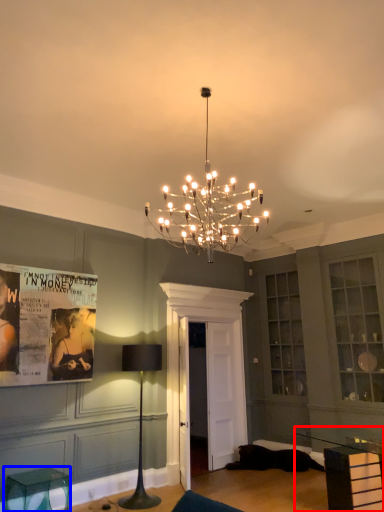
Question: Among these objects, which one is farthest to the camera, table (highlighted by a red box) or furniture (highlighted by a blue box)?

Choices:
 (A) table
 (B) furniture

Answer: (B)